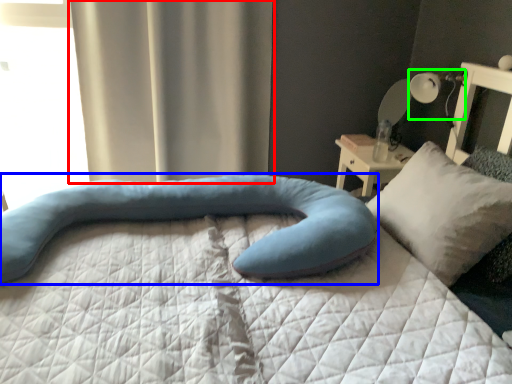
Question: Estimate the real-world distances between objects in this image. Which object is farther from curtain (highlighted by a red box), pillow (highlighted by a blue box) or table lamp (highlighted by a green box)?

Choices:
 (A) pillow
 (B) table lamp

Answer: (B)